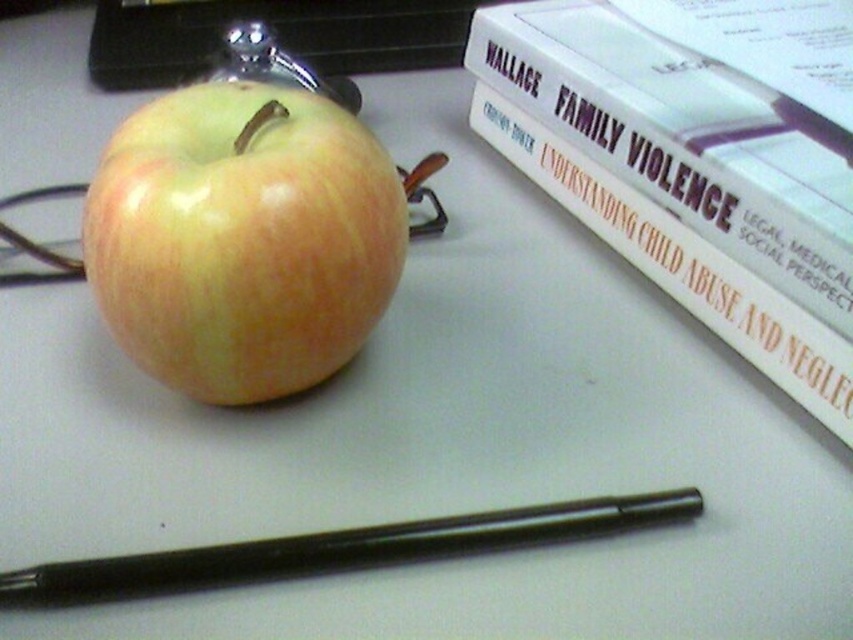
Is hardcover book at upper right to the left of black matte pen at lower center from the viewer's perspective?

No, hardcover book at upper right is not to the left of black matte pen at lower center.

Image resolution: width=853 pixels, height=640 pixels. Find the location of `hardcover book at upper right`. hardcover book at upper right is located at coordinates (683, 180).

Is point (694, 109) positioned in front of point (196, 106)?

No, it is not.

Which is more to the right, hardcover book at upper right or yellow matte apple at center?

Positioned to the right is hardcover book at upper right.

You are a GUI agent. You are given a task and a screenshot of the screen. Output one action in this format:
    pyautogui.click(x=<x>, y=<y>)
    Task: Click on the hardcover book at upper right
    
    Given the screenshot: What is the action you would take?
    pyautogui.click(x=683, y=180)

Is yellow matte apple at center positioned behind black matte pen at lower center?

Yes, it is behind black matte pen at lower center.

Does yellow matte apple at center appear under black matte pen at lower center?

Actually, yellow matte apple at center is above black matte pen at lower center.

Image resolution: width=853 pixels, height=640 pixels. What are the coordinates of `yellow matte apple at center` in the screenshot? It's located at (242, 241).